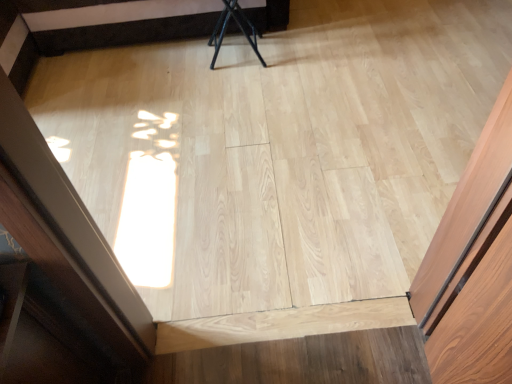
Find the location of a particular element. black metal tripod at upper center is located at coordinates (238, 26).

The image size is (512, 384). Describe the element at coordinates (238, 26) in the screenshot. I see `black metal tripod at upper center` at that location.

Find the location of a particular element. The width and height of the screenshot is (512, 384). black metal tripod at upper center is located at coordinates (238, 26).